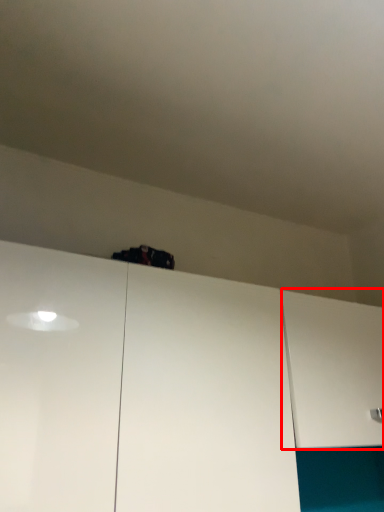
Question: From the image's perspective, where is cabinetry (annotated by the red box) located in relation to cabinetry in the image?

Choices:
 (A) below
 (B) above

Answer: (A)